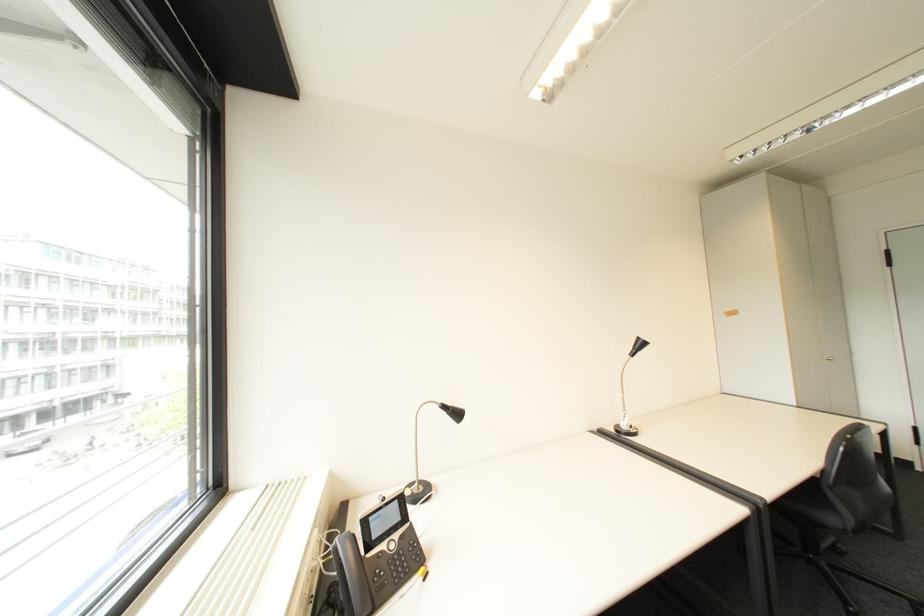
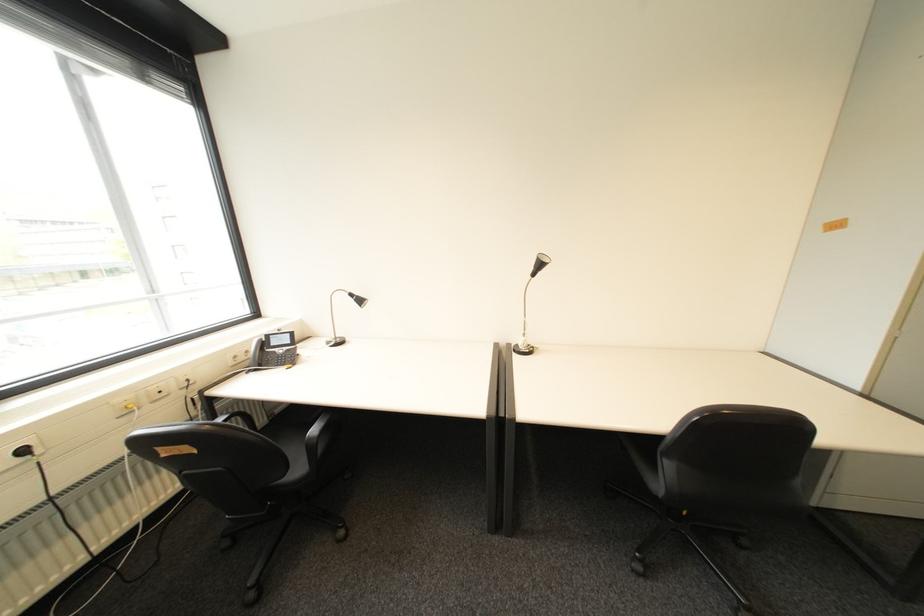
The point at (383, 538) is marked in the first image. Where is the corresponding point in the second image?

(283, 345)